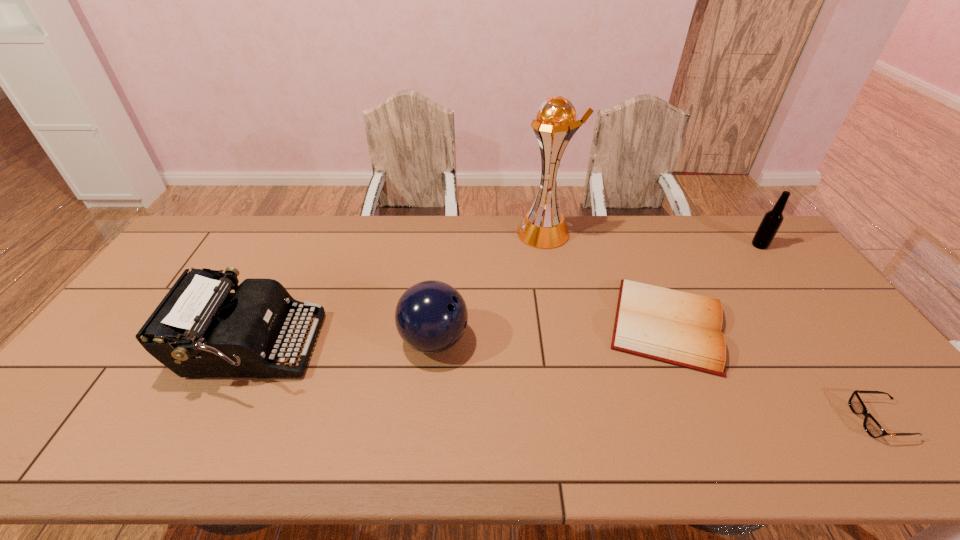
The height and width of the screenshot is (540, 960). What are the coordinates of `empty space between the third object from right to left and the sunglasses` in the screenshot? It's located at (774, 373).

This screenshot has width=960, height=540. In order to click on free area in between the beer bottle and the sunglasses in this screenshot , I will do `click(820, 333)`.

This screenshot has height=540, width=960. What are the coordinates of `free space between the leftmost object and the beer bottle` in the screenshot? It's located at (505, 296).

You are a GUI agent. You are given a task and a screenshot of the screen. Output one action in this format:
    pyautogui.click(x=<x>, y=<y>)
    Task: Click on the free space that is in between the beer bottle and the Bible
    Image resolution: width=960 pixels, height=540 pixels.
    Given the screenshot: What is the action you would take?
    point(713,285)

This screenshot has width=960, height=540. In order to click on free space between the beer bottle and the leftmost object in this screenshot , I will do `click(505, 296)`.

The width and height of the screenshot is (960, 540). What are the coordinates of `empty space between the beer bottle and the second object from left to right` in the screenshot? It's located at (597, 293).

Locate an element on the screen. The height and width of the screenshot is (540, 960). object that is the fifth closest one to the second object from left to right is located at coordinates (772, 220).

Locate which object is the fourth closest to the typewriter. Please provide its 2D coordinates. Your answer should be formatted as a tuple, i.e. [(x, y)], where the tuple contains the x and y coordinates of a point satisfying the conditions above.

[(873, 428)]

The height and width of the screenshot is (540, 960). I want to click on free location that satisfies the following two spatial constraints: 1. on the front-facing side of the third object from left to right; 2. on the left side of the beer bottle, so click(x=547, y=245).

This screenshot has width=960, height=540. What are the coordinates of `vacant position in the image that satisfies the following two spatial constraints: 1. on the front-facing side of the fourth object from right to left; 2. on the right side of the beer bottle` in the screenshot? It's located at (547, 245).